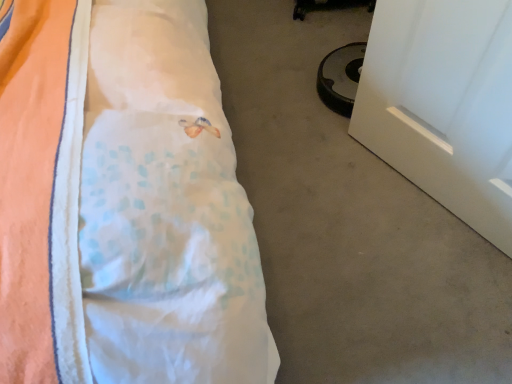
Measure the distance between point (134,37) and camera.

61.80 centimeters.

This screenshot has height=384, width=512. Describe the element at coordinates (123, 203) in the screenshot. I see `white fabric bed at left` at that location.

In order to face white fabric bed at left, should I rotate leftwards or rightwards?

It's best to rotate left around 25.684 degrees.

Locate an element on the screen. The width and height of the screenshot is (512, 384). white fabric bed at left is located at coordinates (123, 203).

Find the location of a particular element. This screenshot has width=512, height=384. white fabric bed at left is located at coordinates (123, 203).